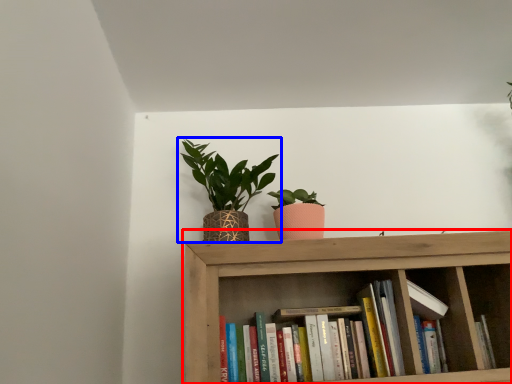
Question: Which of the following is the closest to the observer, shelf (highlighted by a red box) or houseplant (highlighted by a blue box)?

Choices:
 (A) shelf
 (B) houseplant

Answer: (A)